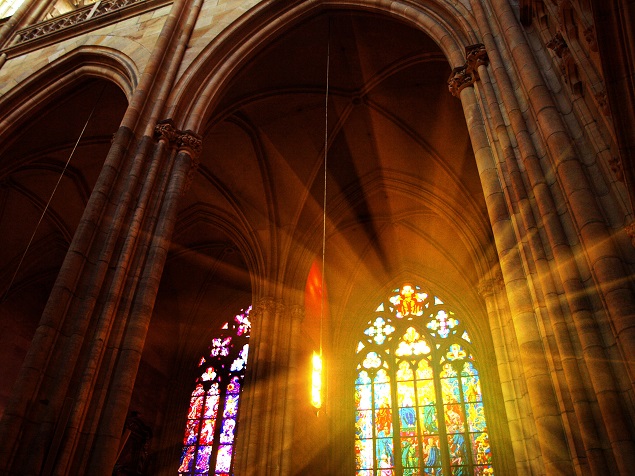
Where is `bright yellow light, center`? This screenshot has height=476, width=635. bright yellow light, center is located at coordinates (319, 363), (318, 387), (315, 398).